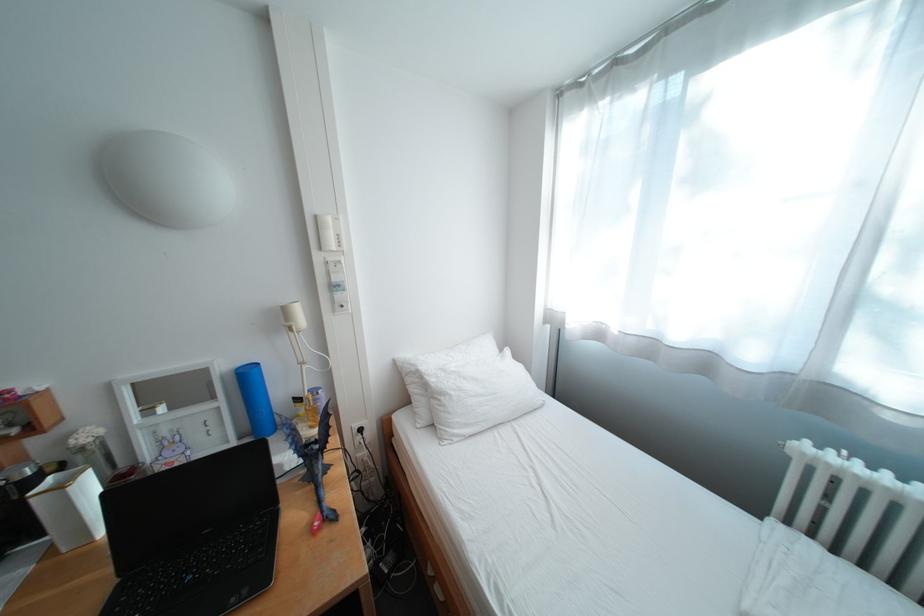
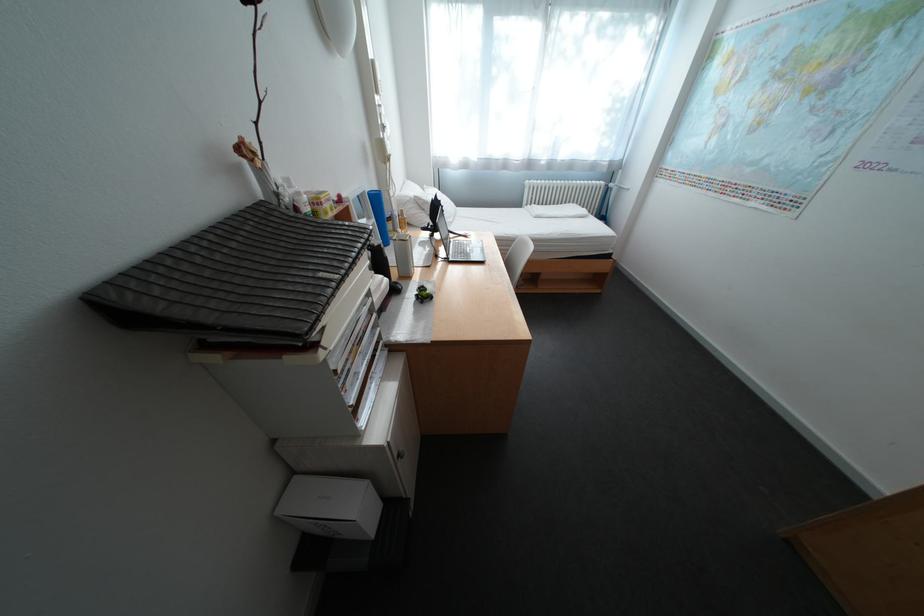
Locate, in the second image, the point that corresponds to pixel 426 370 in the first image.

(420, 200)